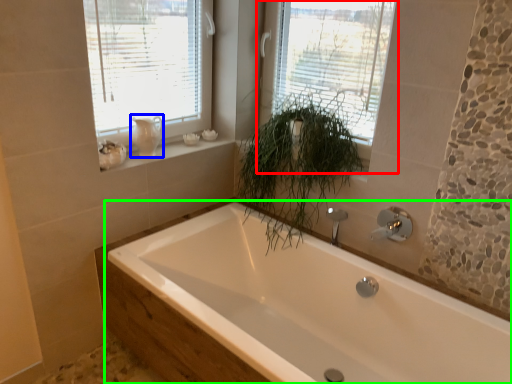
Question: Considering the real-world distances, which object is farthest from window (highlighted by a red box)? gray (highlighted by a blue box) or bathtub (highlighted by a green box)?

Choices:
 (A) gray
 (B) bathtub

Answer: (B)